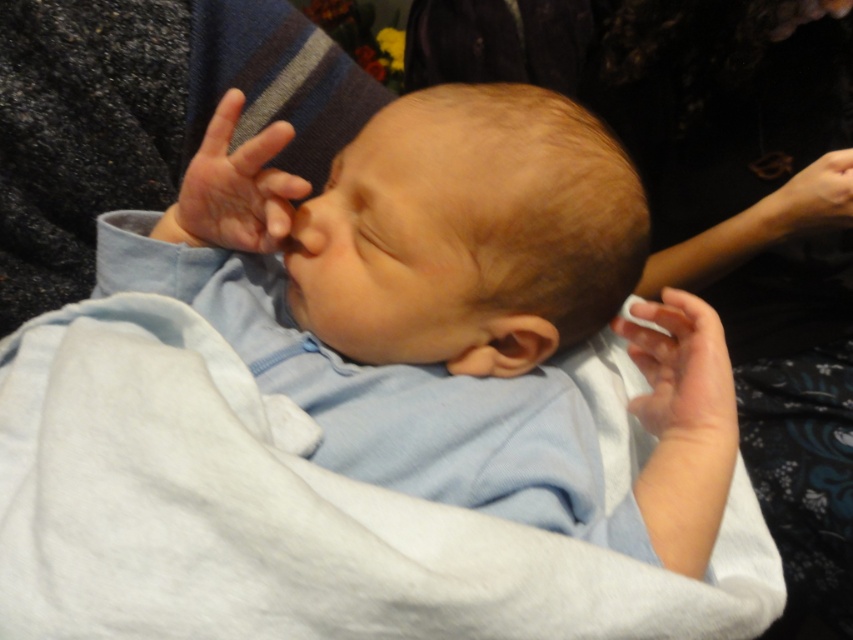
You are a photographer trying to capture a close up of the baby in the image. The focus point of your camera is currently at point [653,500]. Based on the scene description, is this focus point within the baby?

Yes, the focus point at point [653,500] is within the baby since it is 20.51 inches from the camera, which aligns with the baby being the main subject in the close up.

You are a photographer taking a close up shot of a baby. You notice the light blue fabric at center and the smooth flesh nose at center. Which object is positioned to the right of the other?

The light blue fabric at center is to the right of smooth flesh nose at center.

You are a photographer taking a close up shot of a baby. You notice the white soft blanket at center and the smooth flesh nose at center. How far apart are these two elements in inches?

The white soft blanket at center and the smooth flesh nose at center are 7.79 inches apart.